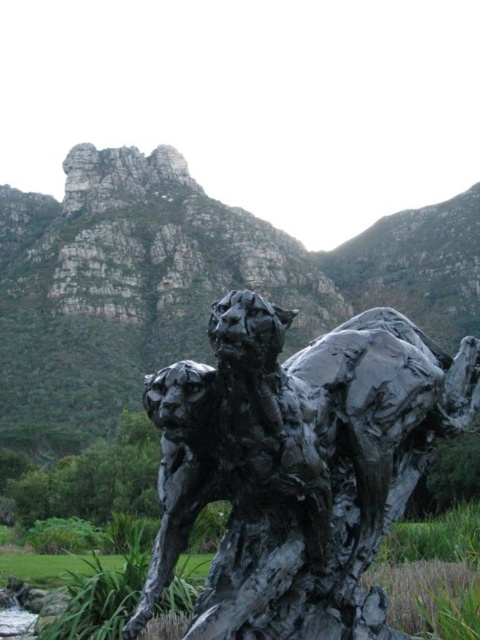
Question: Among these points, which one is nearest to the camera?

Choices:
 (A) (408, 349)
 (B) (479, 230)

Answer: (A)

Question: Does black textured sculpture at center have a larger size compared to rugged stone mountain at upper center?

Choices:
 (A) no
 (B) yes

Answer: (A)

Question: Does black textured sculpture at center have a greater width compared to rugged stone mountain at upper center?

Choices:
 (A) yes
 (B) no

Answer: (B)

Question: Can you confirm if black textured sculpture at center is smaller than rugged stone mountain at upper center?

Choices:
 (A) yes
 (B) no

Answer: (A)

Question: Which point is closer to the camera?

Choices:
 (A) (315, 369)
 (B) (409, 253)

Answer: (A)